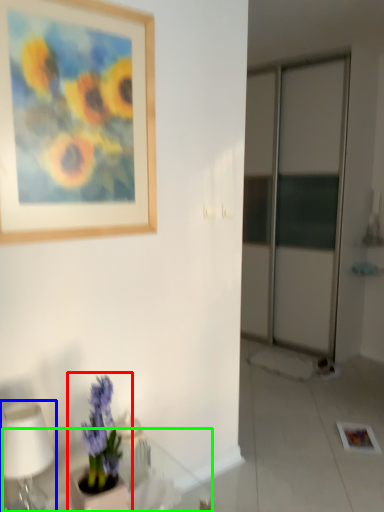
Question: Which object is the farthest from houseplant (highlighted by a red box)? Choose among these: table lamp (highlighted by a blue box) or round table (highlighted by a green box).

Choices:
 (A) table lamp
 (B) round table

Answer: (B)